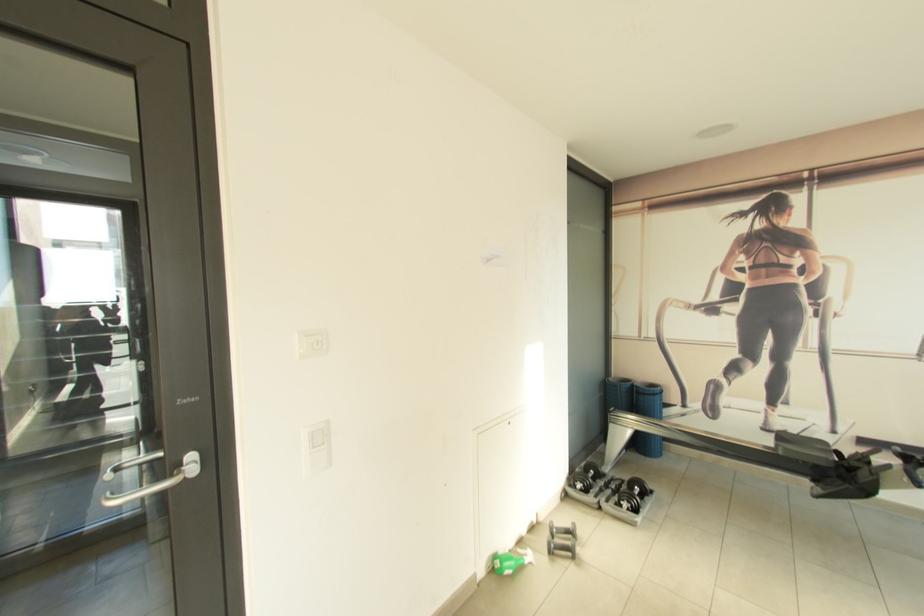
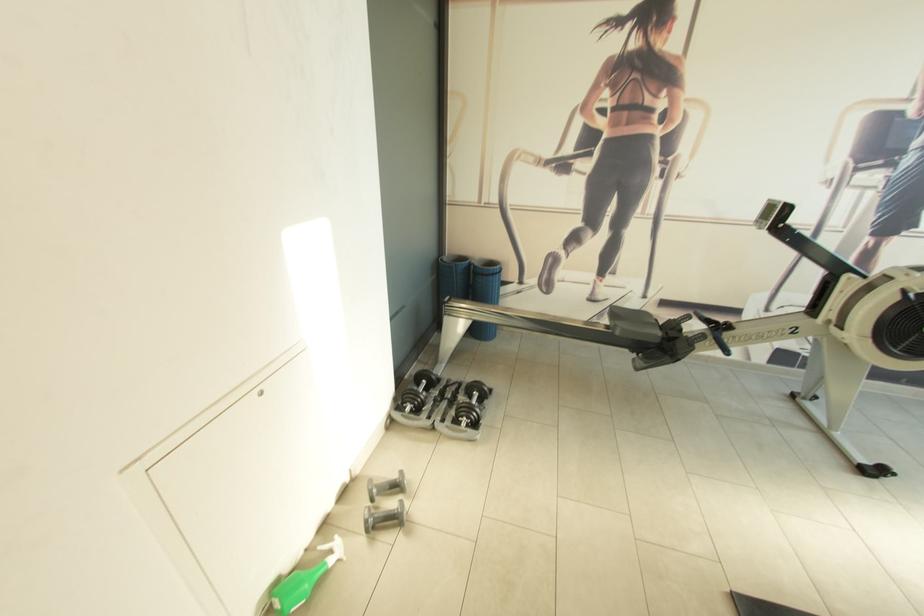
Find the pixel in the second image that matches point 658,387 in the first image.

(497, 265)